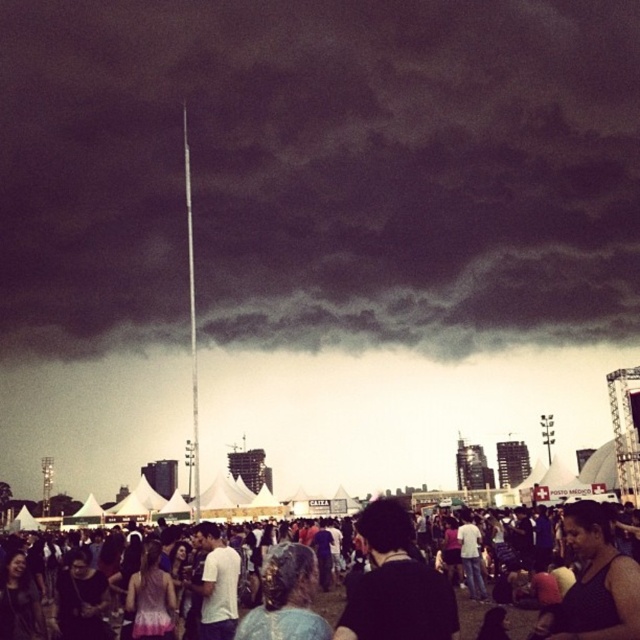
Question: Which object is farther from the camera taking this photo?

Choices:
 (A) dark gray metallic pole at upper center
 (B) white cotton t-shirt at center

Answer: (A)

Question: From the image, what is the correct spatial relationship of black matte hair at center in relation to black tank top at lower right?

Choices:
 (A) above
 (B) below

Answer: (B)

Question: Which of these objects is positioned closest to the dark gray metallic pole at upper center?

Choices:
 (A) gray fabric hair at center
 (B) black tank top at lower right
 (C) matte black crowd at center

Answer: (C)

Question: Does matte black crowd at center lie behind black matte hair at center?

Choices:
 (A) yes
 (B) no

Answer: (B)

Question: From the image, what is the correct spatial relationship of black matte hair at center in relation to gray fabric hair at center?

Choices:
 (A) below
 (B) above

Answer: (B)

Question: Which point is farther to the camera?

Choices:
 (A) black tank top at lower right
 (B) matte black crowd at center
 (C) gray fabric hair at center

Answer: (C)